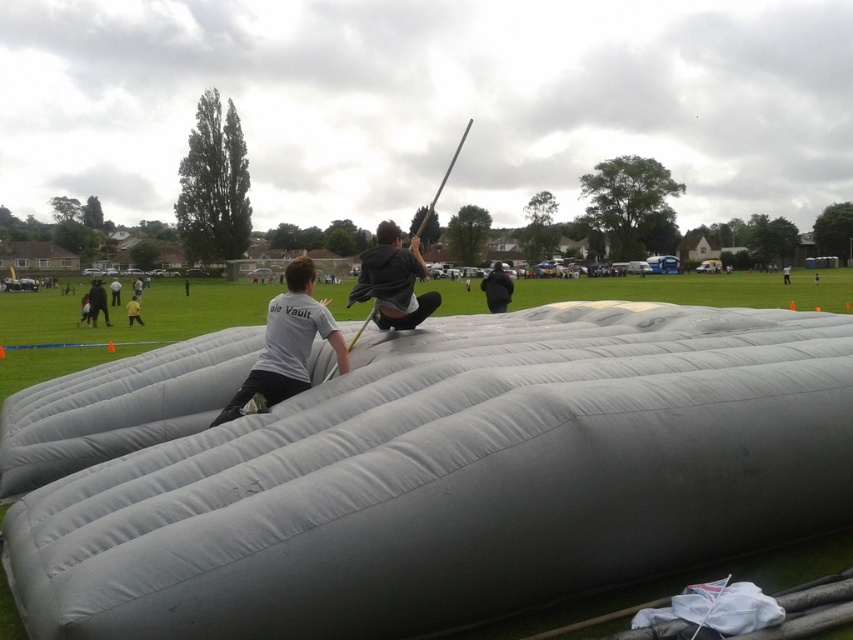
You are standing in the park and see two people on top of the inflatable structure. Which person is nearer to you, the matte gray shirt at center or the dark gray hoodie at center?

The matte gray shirt at center is closer to the viewer than the dark gray hoodie at center.